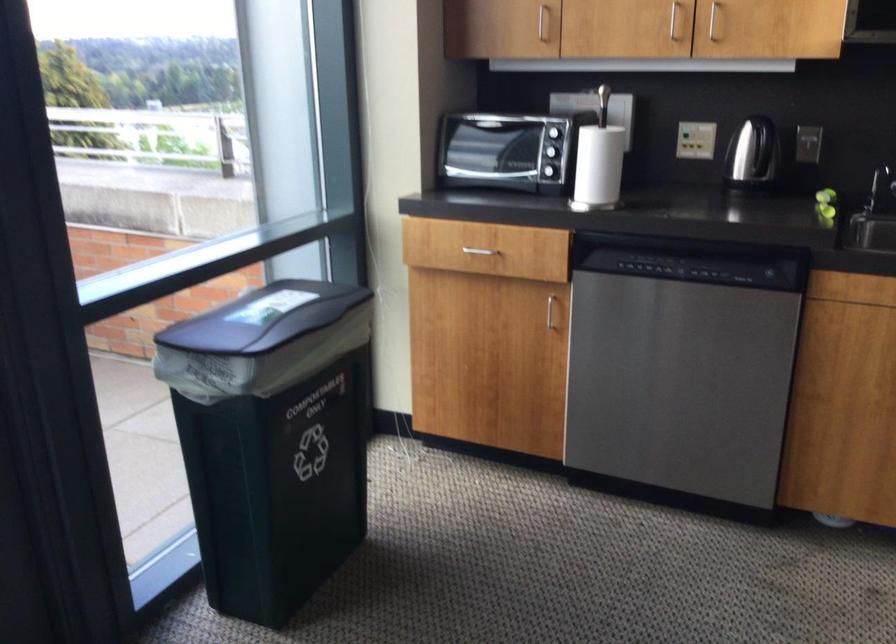
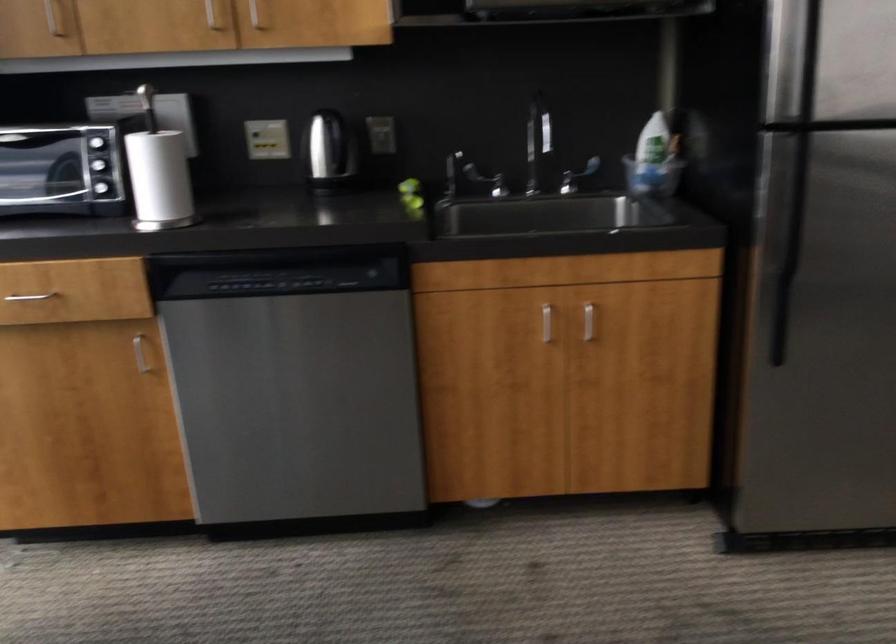
Question: The camera is either moving clockwise (left) or counter-clockwise (right) around the object. The first image is from the beginning of the video and the second image is from the end. Is the camera moving left or right when shooting the video?

Choices:
 (A) Left
 (B) Right

Answer: (A)